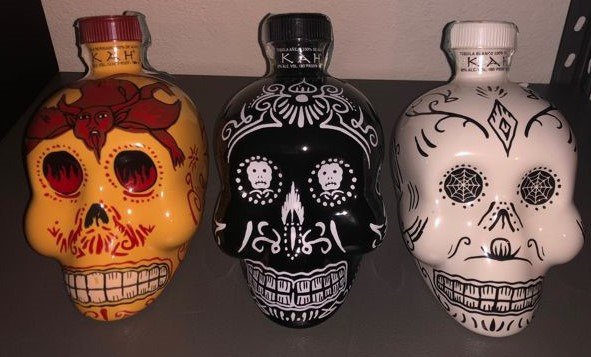
Locate an element on the screen. The height and width of the screenshot is (357, 591). bottles is located at coordinates (100, 115), (301, 126), (499, 139).